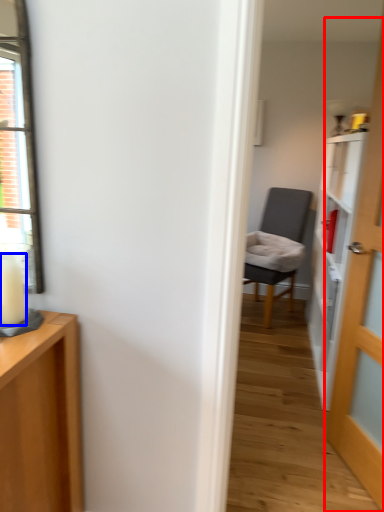
Question: Which of the following is the farthest to the observer, door (highlighted by a red box) or candle (highlighted by a blue box)?

Choices:
 (A) door
 (B) candle

Answer: (A)